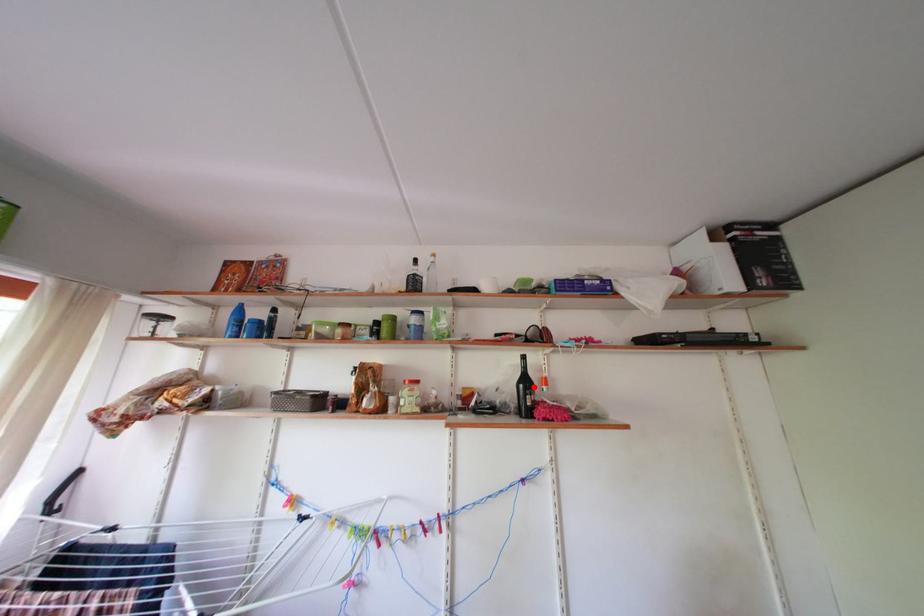
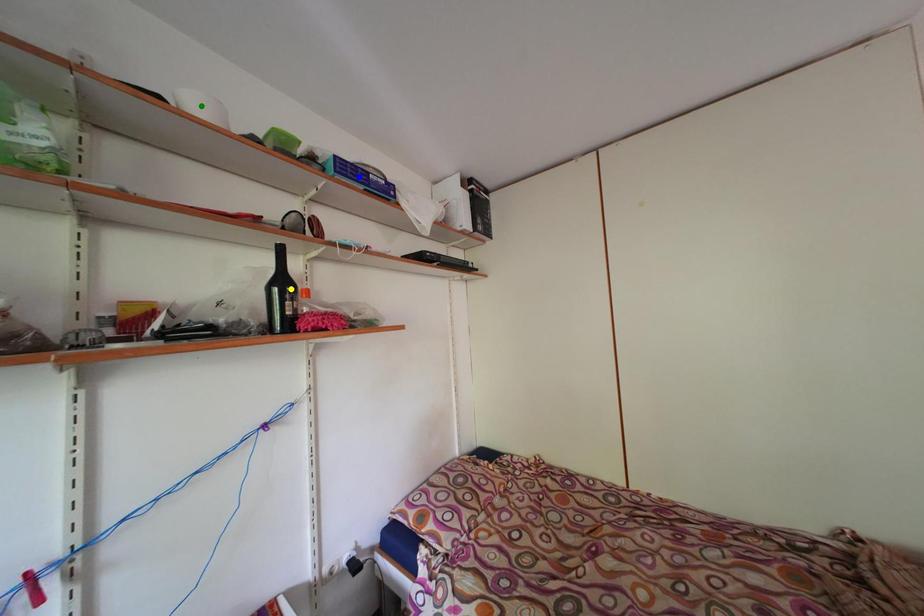
Question: I am providing you with two images of the same scene from different viewpoints. A red point is marked on the first image. You are given multiple points on the second image. Which point in image 2 is actually the same real-world point as the red point in image 1?

Choices:
 (A) green point
 (B) yellow point
 (C) blue point

Answer: (B)